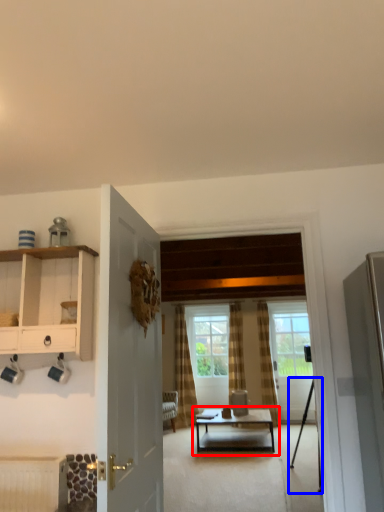
Question: Which object appears farthest to the camera in this image, coffee table (highlighted by a red box) or tripod (highlighted by a blue box)?

Choices:
 (A) coffee table
 (B) tripod

Answer: (A)